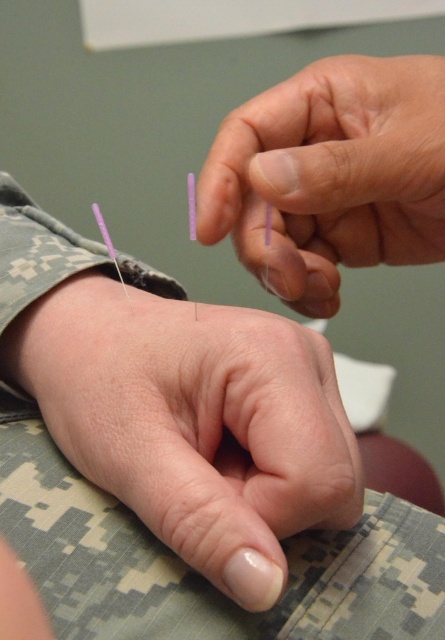
Is smooth skin at center shorter than purple matte needle at wrist?

No.

Does point (250, 438) come behind point (125, 284)?

No, (250, 438) is closer to viewer.

Image resolution: width=445 pixels, height=640 pixels. Find the location of `smooth skin at center`. smooth skin at center is located at coordinates (194, 422).

Can you confirm if transparent plastic needles at upper center is taller than purple matte needle at wrist?

Correct, transparent plastic needles at upper center is much taller as purple matte needle at wrist.

Is transparent plastic needles at upper center bigger than purple matte needle at wrist?

No, transparent plastic needles at upper center is not bigger than purple matte needle at wrist.

You are a GUI agent. You are given a task and a screenshot of the screen. Output one action in this format:
    pyautogui.click(x=<x>, y=<y>)
    Task: Click on the transparent plastic needles at upper center
    The image size is (445, 640).
    Given the screenshot: What is the action you would take?
    pyautogui.click(x=331, y=176)

Where is `transparent plastic needles at upper center`? The width and height of the screenshot is (445, 640). transparent plastic needles at upper center is located at coordinates (331, 176).

Looking at this image, is smooth skin at center to the right of transparent plastic needles at upper center from the viewer's perspective?

In fact, smooth skin at center is to the left of transparent plastic needles at upper center.

Looking at this image, between smooth skin at center and transparent plastic needles at upper center, which one appears on the left side from the viewer's perspective?

Positioned to the left is smooth skin at center.

Does point (189, 561) come behind point (415, 202)?

That is False.

Image resolution: width=445 pixels, height=640 pixels. Find the location of `smooth skin at center`. smooth skin at center is located at coordinates (194, 422).